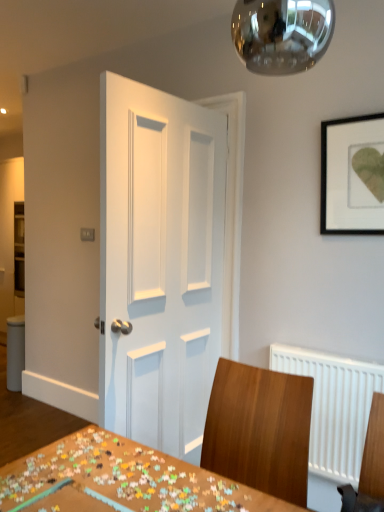
Where is `wooden chair at center`? The image size is (384, 512). wooden chair at center is located at coordinates (259, 429).

Where is `wooden puzzle pieces at center`? Image resolution: width=384 pixels, height=512 pixels. wooden puzzle pieces at center is located at coordinates (121, 480).

Identify the location of white painted wood door at center. This screenshot has width=384, height=512. (159, 262).

Where is `wooden chair at center`? The image size is (384, 512). wooden chair at center is located at coordinates click(259, 429).

The width and height of the screenshot is (384, 512). I want to click on door above the wooden chair at center (from the image's perspective), so click(x=159, y=262).

Considering the positions of objects white painted wood door at center and wooden chair at center in the image provided, who is in front, white painted wood door at center or wooden chair at center?

wooden chair at center is more forward.

Is white painted wood door at center oriented away from wooden chair at center?

Yes, white painted wood door at center's orientation is away from wooden chair at center.

Considering the sizes of objects white painted wood door at center and wooden chair at center in the image provided, who is shorter, white painted wood door at center or wooden chair at center?

Standing shorter between the two is wooden chair at center.

Where is `chair that appears below the black matte picture frame at upper right (from a real-world perspective)`? chair that appears below the black matte picture frame at upper right (from a real-world perspective) is located at coordinates (259, 429).

Can we say black matte picture frame at upper right lies outside wooden chair at center?

Yes, black matte picture frame at upper right is not within wooden chair at center.

In terms of height, does black matte picture frame at upper right look taller or shorter compared to wooden chair at center?

Considering their sizes, black matte picture frame at upper right has less height than wooden chair at center.

Are black matte picture frame at upper right and wooden chair at center far apart?

That's right, there is a large distance between black matte picture frame at upper right and wooden chair at center.

What's the angular difference between white painted wood door at center and wooden puzzle pieces at center's facing directions?

They differ by 3.45 degrees in their facing directions.

Looking at the image, does white painted wood door at center seem bigger or smaller compared to wooden puzzle pieces at center?

Clearly, white painted wood door at center is larger in size than wooden puzzle pieces at center.

Considering the relative sizes of white painted wood door at center and wooden puzzle pieces at center in the image provided, is white painted wood door at center shorter than wooden puzzle pieces at center?

No, white painted wood door at center is not shorter than wooden puzzle pieces at center.

Between point (161, 400) and point (271, 499), which one is positioned behind?

The point (161, 400) is farther from the camera.

Considering the relative sizes of black matte picture frame at upper right and white painted wood door at center in the image provided, is black matte picture frame at upper right smaller than white painted wood door at center?

Yes, black matte picture frame at upper right is smaller than white painted wood door at center.

Considering the relative positions of black matte picture frame at upper right and white painted wood door at center in the image provided, is black matte picture frame at upper right behind white painted wood door at center?

Yes, the depth of black matte picture frame at upper right is greater than that of white painted wood door at center.

Considering the sizes of black matte picture frame at upper right and white painted wood door at center in the image, is black matte picture frame at upper right taller or shorter than white painted wood door at center?

Clearly, black matte picture frame at upper right is shorter compared to white painted wood door at center.

Which point is more forward, (44, 483) or (192, 262)?

Positioned in front is point (44, 483).

From the image's perspective, is wooden puzzle pieces at center located above or below white painted wood door at center?

wooden puzzle pieces at center is situated lower than white painted wood door at center in the image.

Is white painted wood door at center a part of wooden puzzle pieces at center?

No, white painted wood door at center is not inside wooden puzzle pieces at center.

Which object is wider, wooden puzzle pieces at center or wooden chair at center?

Wider between the two is wooden chair at center.

Can wooden chair at center be found inside wooden puzzle pieces at center?

Actually, wooden chair at center is outside wooden puzzle pieces at center.

Considering the sizes of objects wooden puzzle pieces at center and wooden chair at center in the image provided, who is bigger, wooden puzzle pieces at center or wooden chair at center?

With larger size is wooden chair at center.

Is wooden puzzle pieces at center positioned with its back to wooden chair at center?

Yes, wooden chair at center is at the back of wooden puzzle pieces at center.

Is the position of white painted wood door at center less distant than that of black matte picture frame at upper right?

Yes, white painted wood door at center is in front of black matte picture frame at upper right.

Based on their sizes in the image, would you say white painted wood door at center is bigger or smaller than black matte picture frame at upper right?

In the image, white painted wood door at center appears to be larger than black matte picture frame at upper right.

Which is more to the left, white painted wood door at center or black matte picture frame at upper right?

Positioned to the left is white painted wood door at center.

Does white painted wood door at center have a greater height compared to black matte picture frame at upper right?

Correct, white painted wood door at center is much taller as black matte picture frame at upper right.

Find the location of a particular element. door behind the wooden chair at center is located at coordinates (159, 262).

At what (x,y) coordinates should I click in order to perform the action: click on picture frame above the wooden chair at center (from the image's perspective). Please return your answer as a coordinate pair (x, y). The width and height of the screenshot is (384, 512). Looking at the image, I should click on (352, 175).

Based on their spatial positions, is white painted wood door at center or wooden puzzle pieces at center closer to black matte picture frame at upper right?

white painted wood door at center.

Based on their spatial positions, is wooden puzzle pieces at center or white painted wood door at center further from black matte picture frame at upper right?

wooden puzzle pieces at center is positioned further to the anchor black matte picture frame at upper right.

Estimate the real-world distances between objects in this image. Which object is closer to black matte picture frame at upper right, wooden puzzle pieces at center or wooden chair at center?

wooden chair at center.

Based on their spatial positions, is wooden chair at center or wooden puzzle pieces at center closer to white painted wood door at center?

wooden chair at center is closer to white painted wood door at center.

Which object lies further to the anchor point black matte picture frame at upper right, wooden chair at center or white painted wood door at center?

wooden chair at center is further to black matte picture frame at upper right.

Considering their positions, is white painted wood door at center positioned further to wooden puzzle pieces at center than black matte picture frame at upper right?

black matte picture frame at upper right lies further to wooden puzzle pieces at center than the other object.

Estimate the real-world distances between objects in this image. Which object is closer to white painted wood door at center, black matte picture frame at upper right or wooden chair at center?

wooden chair at center.

Considering their positions, is wooden puzzle pieces at center positioned further to wooden chair at center than white painted wood door at center?

white painted wood door at center is further to wooden chair at center.

Identify the location of table between black matte picture frame at upper right and wooden chair at center vertically. (121, 480).

At what (x,y) coordinates should I click in order to perform the action: click on chair positioned between wooden puzzle pieces at center and white painted wood door at center from near to far. Please return your answer as a coordinate pair (x, y). This screenshot has height=512, width=384. Looking at the image, I should click on (259, 429).

This screenshot has height=512, width=384. I want to click on door between black matte picture frame at upper right and wooden chair at center in the vertical direction, so click(159, 262).

You are a GUI agent. You are given a task and a screenshot of the screen. Output one action in this format:
    pyautogui.click(x=<x>, y=<y>)
    Task: Click on the door between wooden puzzle pieces at center and black matte picture frame at upper right along the z-axis
    The width and height of the screenshot is (384, 512).
    Given the screenshot: What is the action you would take?
    pyautogui.click(x=159, y=262)